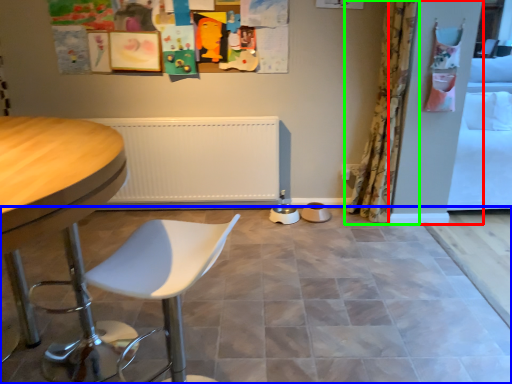
Question: Which object is the farthest from screen door (highlighted by a red box)? Choose among these: ceramic tile (highlighted by a blue box) or curtain (highlighted by a green box).

Choices:
 (A) ceramic tile
 (B) curtain

Answer: (A)